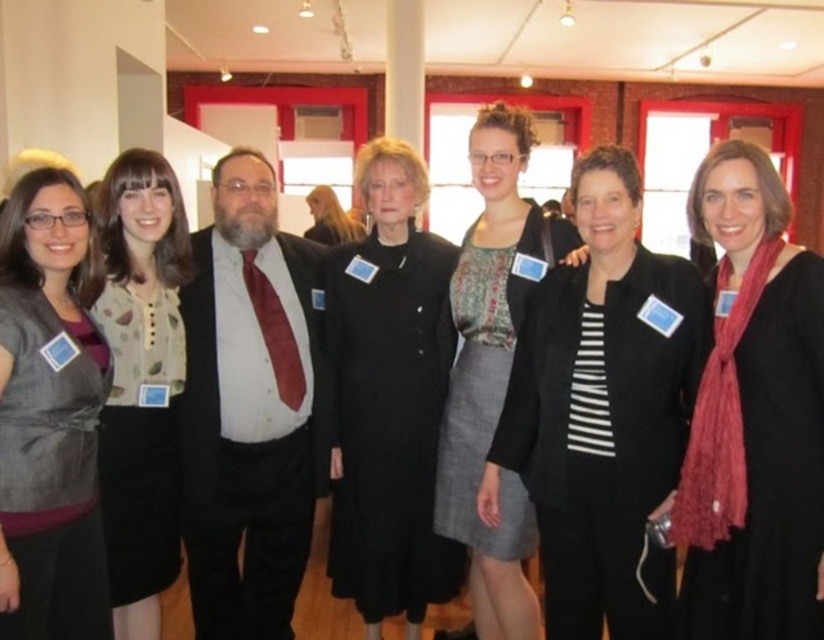
Question: From the image, what is the correct spatial relationship of black striped blazer at center in relation to matte black coat at center?

Choices:
 (A) left
 (B) right

Answer: (B)

Question: Estimate the real-world distances between objects in this image. Which object is farther from the matte black coat at center?

Choices:
 (A) printed fabric dress at center
 (B) matte white shirt at center

Answer: (A)

Question: Which object appears farthest from the camera in this image?

Choices:
 (A) black scarf at center
 (B) matte black dress at left
 (C) matte white shirt at center

Answer: (C)

Question: Does matte black dress at left lie in front of printed fabric dress at center?

Choices:
 (A) no
 (B) yes

Answer: (B)

Question: Which of the following is the closest to the observer?

Choices:
 (A) matte black coat at center
 (B) matte gray cardigan at left
 (C) matte white shirt at center
 (D) matte black dress at left

Answer: (B)

Question: In this image, where is matte white shirt at center located relative to matte gray cardigan at left?

Choices:
 (A) left
 (B) right

Answer: (B)